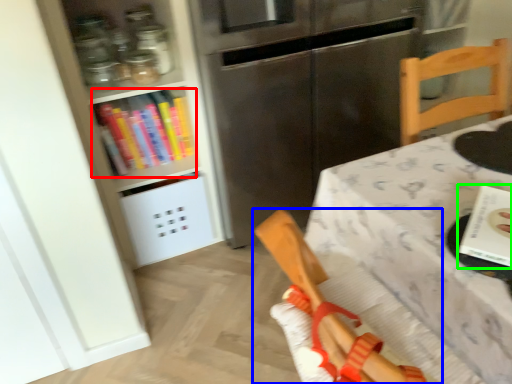
Question: Which is farther away from book (highlighted by a red box)? chair (highlighted by a blue box) or book (highlighted by a green box)?

Choices:
 (A) chair
 (B) book

Answer: (B)